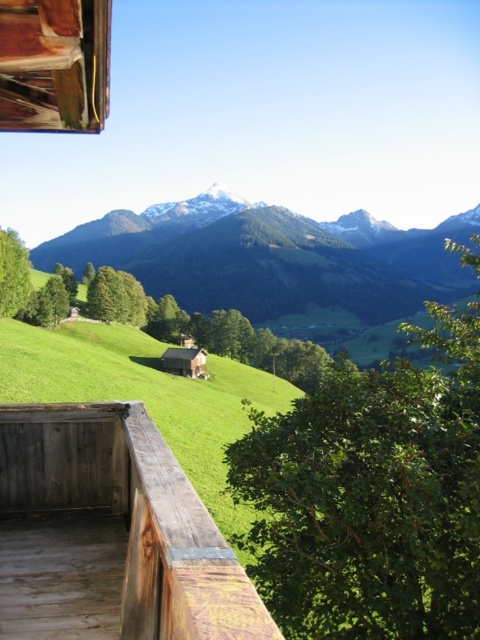
Which of these two, weathered wood deck at lower left or green grassy field at center, stands taller?

green grassy field at center

Is weathered wood deck at lower left above green grassy field at center?

Incorrect, weathered wood deck at lower left is not positioned above green grassy field at center.

Find the location of a particular element. weathered wood deck at lower left is located at coordinates (110, 534).